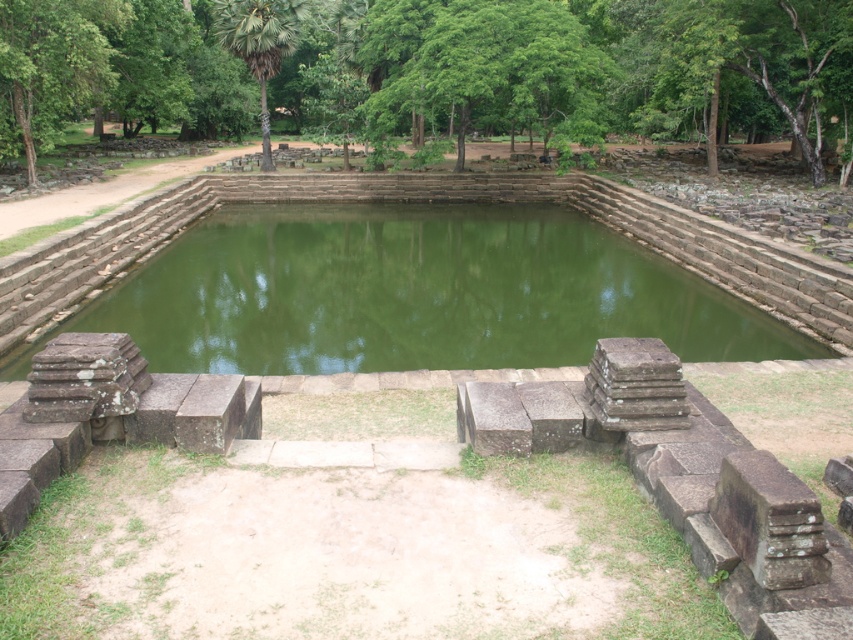
Which is more to the right, green leafy tree at upper left or green leafy palm tree at upper center?

green leafy palm tree at upper center

Is point (3, 67) farther from viewer compared to point (271, 45)?

No, (3, 67) is in front of (271, 45).

You are a GUI agent. You are given a task and a screenshot of the screen. Output one action in this format:
    pyautogui.click(x=<x>, y=<y>)
    Task: Click on the green leafy tree at upper left
    This screenshot has height=640, width=853.
    Given the screenshot: What is the action you would take?
    pyautogui.click(x=51, y=67)

Does green leafy tree at center appear under green leafy tree at upper left?

No.

Can you confirm if green leafy tree at center is bigger than green leafy tree at upper left?

Correct, green leafy tree at center is larger in size than green leafy tree at upper left.

This screenshot has height=640, width=853. What are the coordinates of `green leafy tree at center` in the screenshot? It's located at (431, 67).

From the picture: Between green leafy tree at center and green stone lake at center, which one is positioned lower?

Positioned lower is green stone lake at center.

Is green leafy tree at center further to the viewer compared to green stone lake at center?

Yes, green leafy tree at center is further from the viewer.

Who is more forward, (627, 124) or (289, 208)?

Point (289, 208) is more forward.

I want to click on green leafy tree at center, so click(x=431, y=67).